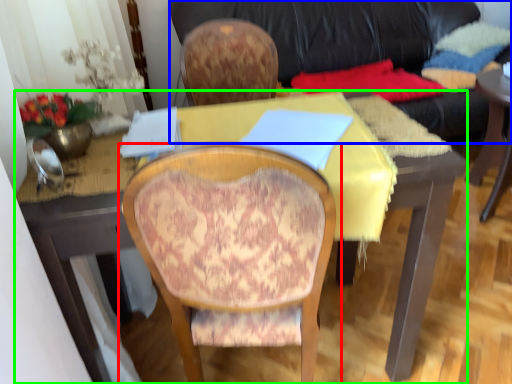
Question: Considering the real-world distances, which object is closest to chair (highlighted by a red box)? studio couch (highlighted by a blue box) or desk (highlighted by a green box).

Choices:
 (A) studio couch
 (B) desk

Answer: (B)